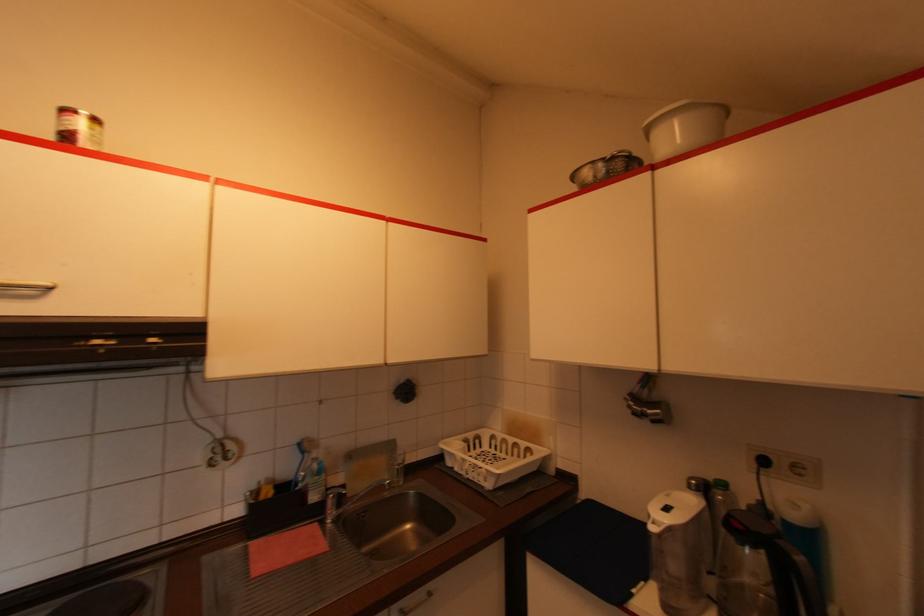
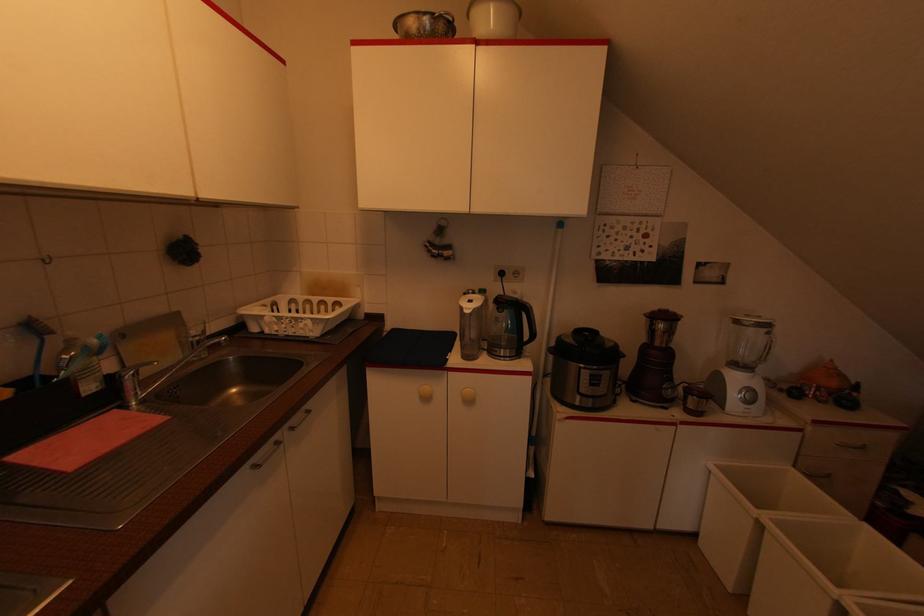
The images are taken continuously from a first-person perspective. In which direction is your viewpoint rotating?

The rotation direction of the camera is right-down.